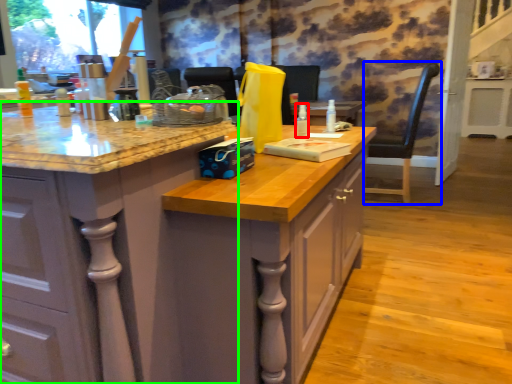
Question: Which object is positioned farthest from bottle (highlighted by a red box)? Select from chair (highlighted by a blue box) and cabinetry (highlighted by a green box).

Choices:
 (A) chair
 (B) cabinetry

Answer: (A)